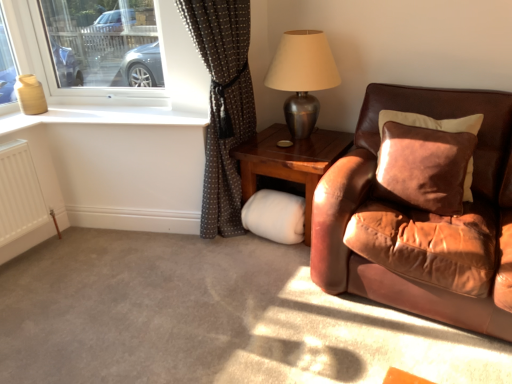
The height and width of the screenshot is (384, 512). What are the coordinates of `free space above wooden side table at right (from a real-world perspective)` in the screenshot? It's located at (292, 147).